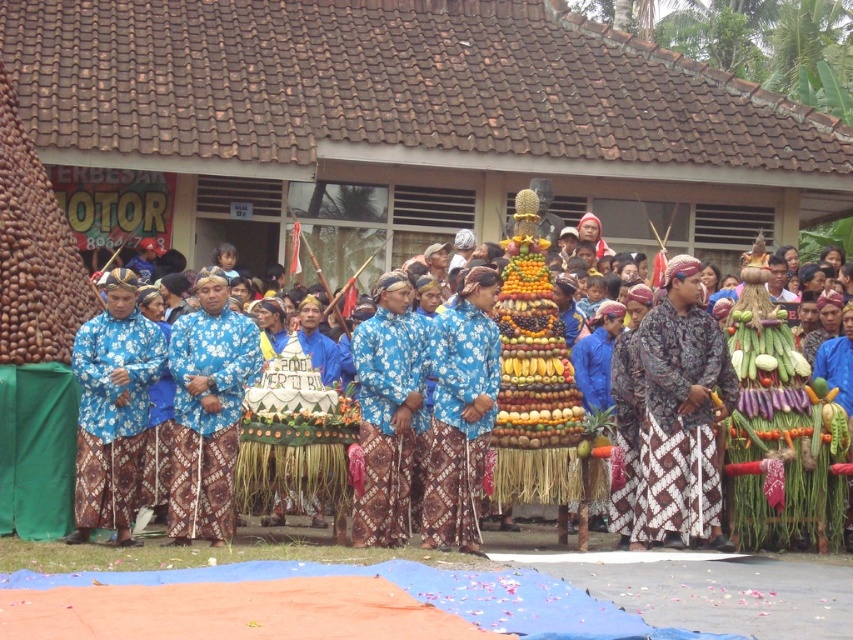
Question: Can you confirm if blue batik fabric at center is positioned below blue batik cloth at center?

Choices:
 (A) no
 (B) yes

Answer: (A)

Question: Does blue batik fabric at center appear under blue batik cloth at center?

Choices:
 (A) yes
 (B) no

Answer: (B)

Question: Which of the following is the closest to the observer?

Choices:
 (A) blue batik fabric at center
 (B) blue batik cloth at center

Answer: (B)

Question: Can you confirm if blue batik fabric at center is positioned to the left of blue batik cloth at center?

Choices:
 (A) yes
 (B) no

Answer: (B)